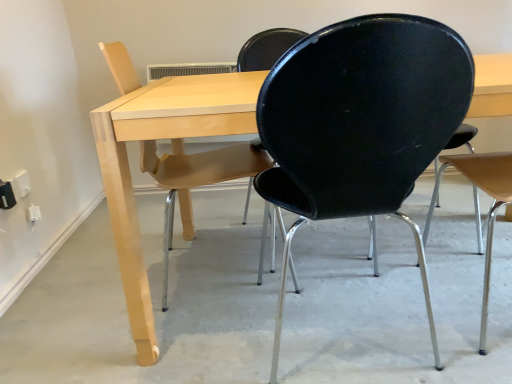
Question: From a real-world perspective, is black plastic chair at center, arranged as the second chair when viewed from the right, on light wood table at center?

Choices:
 (A) no
 (B) yes

Answer: (B)

Question: From a real-world perspective, is black plastic chair at center, which ranks as the second chair in left-to-right order, physically below light wood table at center?

Choices:
 (A) yes
 (B) no

Answer: (B)

Question: Could you tell me if black plastic chair at center, which ranks as the second chair in left-to-right order, is turned towards light wood table at center?

Choices:
 (A) no
 (B) yes

Answer: (B)

Question: From the image's perspective, is black plastic chair at center, arranged as the second chair when viewed from the right, beneath light wood table at center?

Choices:
 (A) yes
 (B) no

Answer: (A)

Question: Does black plastic chair at center, which ranks as the second chair in left-to-right order, have a lesser height compared to light wood table at center?

Choices:
 (A) no
 (B) yes

Answer: (A)

Question: Do you think light wood table at center is within matte wood chair at left, the 3th chair positioned from the right, or outside of it?

Choices:
 (A) outside
 (B) inside

Answer: (A)

Question: From the image's perspective, is light wood table at center positioned above or below matte wood chair at left, the 3th chair positioned from the right?

Choices:
 (A) below
 (B) above

Answer: (A)

Question: From a real-world perspective, is light wood table at center physically located above or below matte wood chair at left, the 3th chair positioned from the right?

Choices:
 (A) below
 (B) above

Answer: (A)

Question: Is light wood table at center to the left or to the right of matte wood chair at left, the 3th chair positioned from the right, in the image?

Choices:
 (A) right
 (B) left

Answer: (A)

Question: Considering their positions, is matte wood chair at left, which appears as the first chair when viewed from the left, located in front of or behind black matte chair at right, positioned as the first chair in right-to-left order?

Choices:
 (A) front
 (B) behind

Answer: (B)

Question: Considering the positions of matte wood chair at left, which appears as the first chair when viewed from the left, and black matte chair at right, acting as the 3th chair starting from the left, in the image, is matte wood chair at left, which appears as the first chair when viewed from the left, bigger or smaller than black matte chair at right, acting as the 3th chair starting from the left,?

Choices:
 (A) big
 (B) small

Answer: (B)

Question: Which is correct: matte wood chair at left, the 3th chair positioned from the right, is inside black matte chair at right, positioned as the first chair in right-to-left order, or outside of it?

Choices:
 (A) outside
 (B) inside

Answer: (A)

Question: From a real-world perspective, is matte wood chair at left, which appears as the first chair when viewed from the left, physically located above or below black matte chair at right, acting as the 3th chair starting from the left?

Choices:
 (A) below
 (B) above

Answer: (A)

Question: From the image's perspective, is light wood table at center positioned above or below black matte chair at right, acting as the 3th chair starting from the left?

Choices:
 (A) above
 (B) below

Answer: (B)

Question: Is light wood table at center wider or thinner than black matte chair at right, acting as the 3th chair starting from the left?

Choices:
 (A) wide
 (B) thin

Answer: (A)